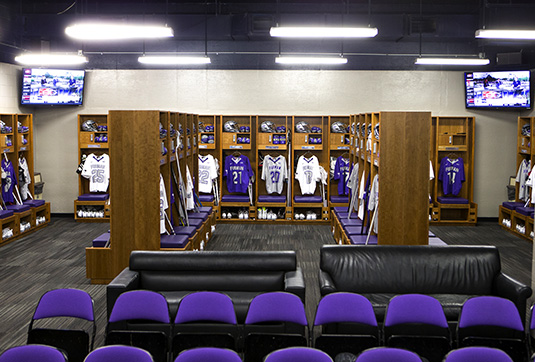
At what (x,y) coordinates should I click in order to perform the action: click on tv monitors. Please return your answer as a coordinate pair (x, y). This screenshot has height=362, width=535. Looking at the image, I should click on (58, 96), (515, 94).